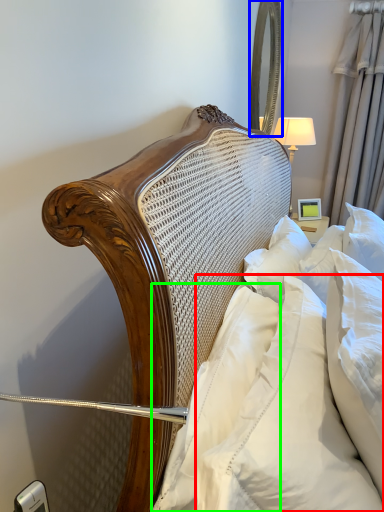
Question: Considering the real-world distances, which object is farthest from pillow (highlighted by a red box)? mirror (highlighted by a blue box) or pillow (highlighted by a green box)?

Choices:
 (A) mirror
 (B) pillow

Answer: (A)